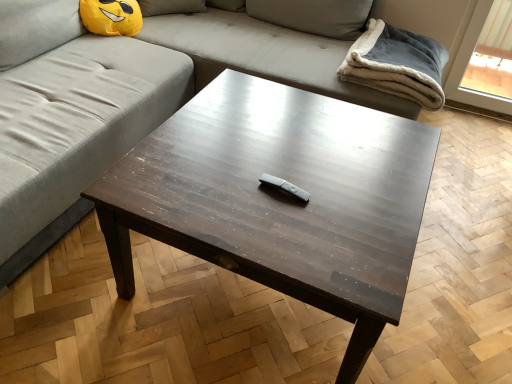
Question: Can you confirm if gray fleece blanket at upper right is positioned to the left of gray fabric couch at upper center?

Choices:
 (A) yes
 (B) no

Answer: (B)

Question: Does gray fleece blanket at upper right have a lesser width compared to gray fabric couch at upper center?

Choices:
 (A) no
 (B) yes

Answer: (B)

Question: Does gray fleece blanket at upper right have a lesser height compared to gray fabric couch at upper center?

Choices:
 (A) no
 (B) yes

Answer: (B)

Question: From a real-world perspective, is gray fleece blanket at upper right positioned under gray fabric couch at upper center based on gravity?

Choices:
 (A) no
 (B) yes

Answer: (A)

Question: Is gray fabric couch at upper center at the back of gray fleece blanket at upper right?

Choices:
 (A) yes
 (B) no

Answer: (A)

Question: From a real-world perspective, is gray fleece blanket at upper right located higher than gray fabric couch at upper center?

Choices:
 (A) yes
 (B) no

Answer: (A)

Question: Can we say gray fleece blanket at upper right lies outside dark wood remote control at center?

Choices:
 (A) yes
 (B) no

Answer: (A)

Question: Is gray fleece blanket at upper right in contact with dark wood remote control at center?

Choices:
 (A) no
 (B) yes

Answer: (A)

Question: From the image's perspective, is gray fleece blanket at upper right on dark wood remote control at center?

Choices:
 (A) no
 (B) yes

Answer: (B)

Question: From a real-world perspective, is gray fleece blanket at upper right positioned over dark wood remote control at center based on gravity?

Choices:
 (A) no
 (B) yes

Answer: (B)

Question: Is the position of gray fleece blanket at upper right less distant than that of dark wood remote control at center?

Choices:
 (A) yes
 (B) no

Answer: (B)

Question: Is gray fleece blanket at upper right to the right of dark wood remote control at center from the viewer's perspective?

Choices:
 (A) no
 (B) yes

Answer: (B)

Question: Would you consider gray fabric couch at upper center to be distant from gray matte wii remote at center?

Choices:
 (A) no
 (B) yes

Answer: (B)